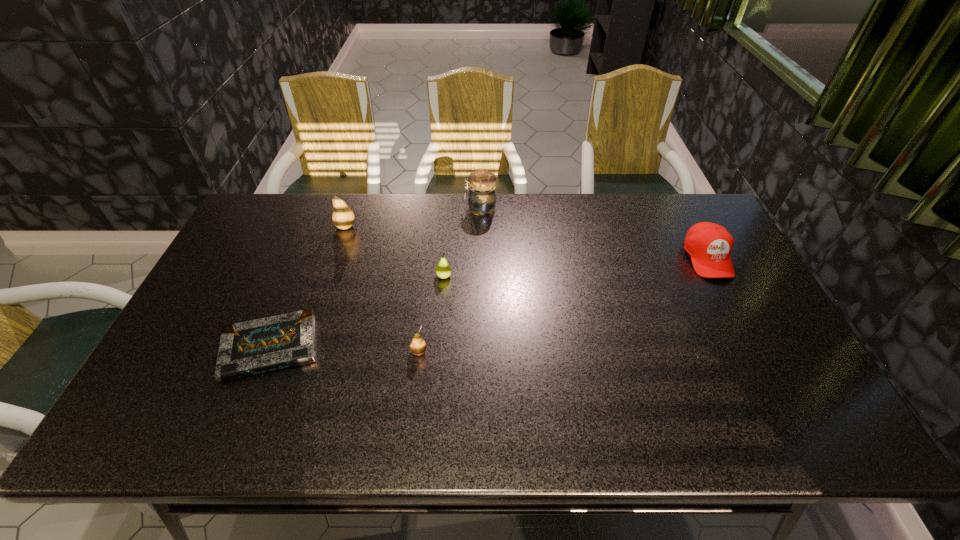
Locate an element on the screen. This screenshot has height=540, width=960. baseball cap that is at the far edge is located at coordinates (709, 245).

I want to click on object present at the left edge, so click(x=257, y=346).

Where is `object positioned at the right edge`? This screenshot has height=540, width=960. object positioned at the right edge is located at coordinates (709, 245).

Locate an element on the screen. Image resolution: width=960 pixels, height=540 pixels. object that is at the far right corner is located at coordinates click(x=709, y=245).

The image size is (960, 540). In order to click on free location at the far edge of the desktop in this screenshot , I will do `click(356, 205)`.

At what (x,y) coordinates should I click in order to perform the action: click on free spot at the near edge of the desktop. Please return your answer as a coordinate pair (x, y). The width and height of the screenshot is (960, 540). Looking at the image, I should click on (468, 418).

In the image, there is a desktop. Where is `free space at the left edge`? free space at the left edge is located at coordinates (256, 262).

Identify the location of vacant point at the right edge. The height and width of the screenshot is (540, 960). (743, 277).

This screenshot has height=540, width=960. Find the location of `vacant space at the near left corner of the desktop`. vacant space at the near left corner of the desktop is located at coordinates (134, 425).

Find the location of a particular element. free space between the fifth object from left to right and the baseball cap is located at coordinates (594, 233).